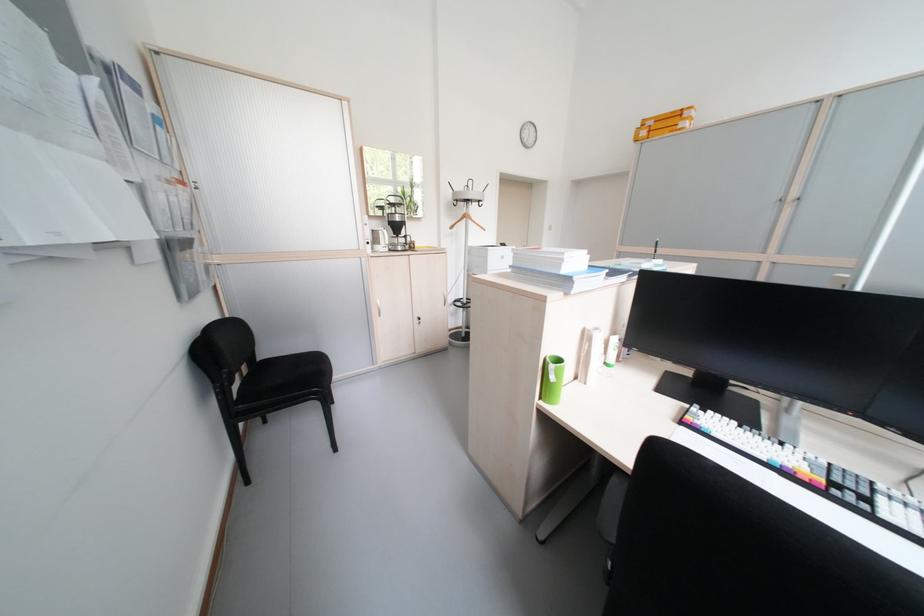
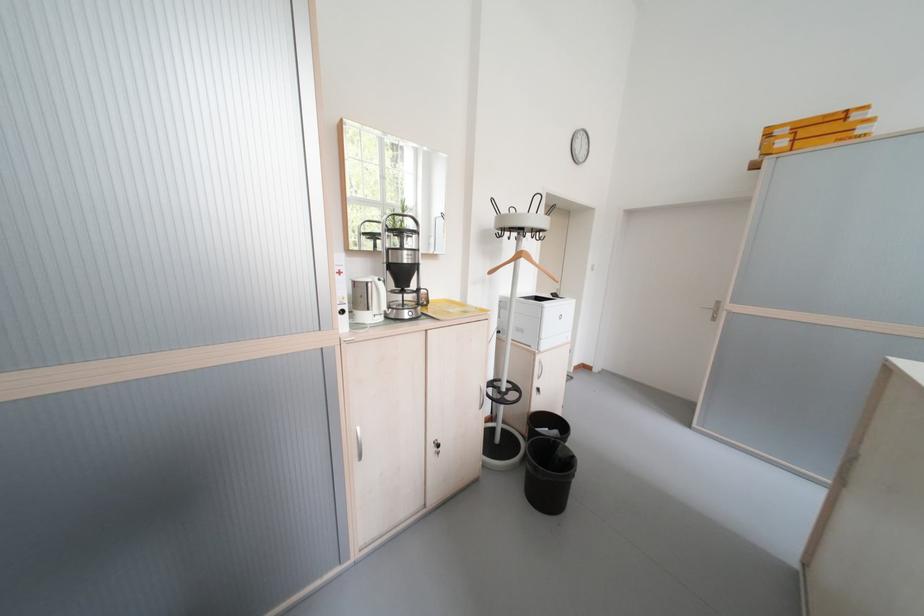
In the second image, find the point that corresponds to the point at 384,314 in the first image.

(359, 455)